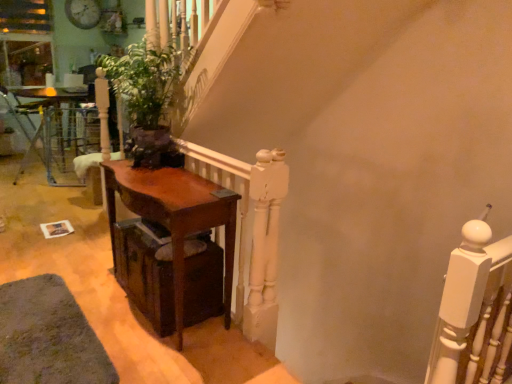
What are the coordinates of `vacant space in front of dark wood drawer at lower left` in the screenshot? It's located at (165, 352).